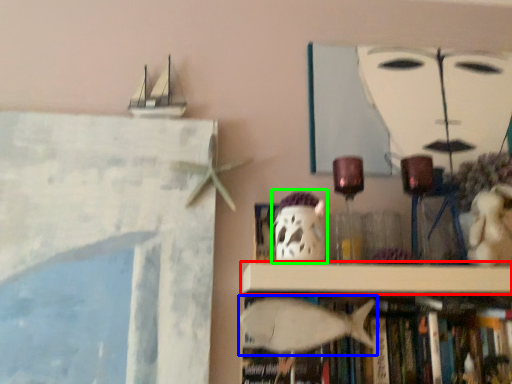
Question: Considering the real-world distances, which object is closest to shelf (highlighted by a red box)? animal (highlighted by a blue box) or ghost (highlighted by a green box).

Choices:
 (A) animal
 (B) ghost

Answer: (A)